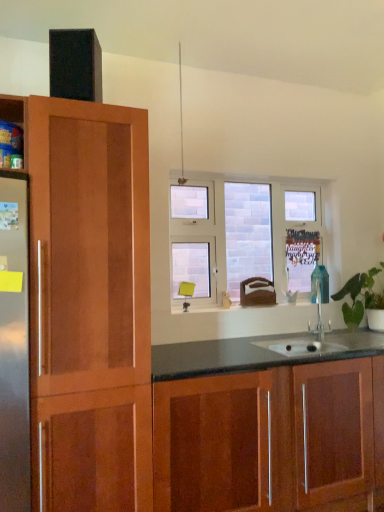
You are a GUI agent. You are given a task and a screenshot of the screen. Output one action in this format:
    pyautogui.click(x=<x>, y=<y>)
    Task: Click on the green leafy plant at right
    This screenshot has height=512, width=384.
    Given the screenshot: What is the action you would take?
    pyautogui.click(x=359, y=294)

Measure the distance between point (347, 322) and camera.

Point (347, 322) and camera are 2.86 meters apart.

Locate an element on the screen. glossy wood cabinets at lower center is located at coordinates (271, 439).

Is the surface of glossy wood cabinets at lower center in direct contact with clear glass window at center?

glossy wood cabinets at lower center and clear glass window at center are clearly separated.

Does point (239, 506) appear closer or farther from the camera than point (221, 182)?

Point (239, 506) appears to be closer to the viewer than point (221, 182).

Does glossy wood cabinets at lower center have a greater width compared to clear glass window at center?

Correct, the width of glossy wood cabinets at lower center exceeds that of clear glass window at center.

Based on the photo, what's the angular difference between glossy wood cabinets at lower center and clear glass window at center's facing directions?

The angle between the facing direction of glossy wood cabinets at lower center and the facing direction of clear glass window at center is 0.284 degrees.

From their relative heights in the image, would you say clear glass window at center is taller or shorter than glossy wood cabinets at lower center?

In the image, clear glass window at center appears to be taller than glossy wood cabinets at lower center.

In the scene shown: Is there a large distance between clear glass window at center and glossy wood cabinets at lower center?

Yes, clear glass window at center is far from glossy wood cabinets at lower center.

Does clear glass window at center have a lesser width compared to glossy wood cabinets at lower center?

Correct, the width of clear glass window at center is less than that of glossy wood cabinets at lower center.

Considering the relative sizes of clear glass window at center and glossy wood cabinets at lower center in the image provided, is clear glass window at center smaller than glossy wood cabinets at lower center?

Yes.

Is glossy wood cabinets at lower center inside the boundaries of green leafy plant at right, or outside?

glossy wood cabinets at lower center exists outside the volume of green leafy plant at right.

Is point (293, 387) farther from viewer compared to point (352, 311)?

No, (293, 387) is in front of (352, 311).

Is glossy wood cabinets at lower center oriented towards green leafy plant at right?

No, glossy wood cabinets at lower center does not turn towards green leafy plant at right.

From the image's perspective, is glossy wood cabinets at lower center on green leafy plant at right?

No, from the image's perspective, glossy wood cabinets at lower center is not over green leafy plant at right.

Measure the distance from green leafy plant at right to clear glass window at center.

A distance of 24.69 inches exists between green leafy plant at right and clear glass window at center.

Is green leafy plant at right not close to clear glass window at center?

They are positioned close to each other.

Would you say green leafy plant at right contains clear glass window at center?

No, clear glass window at center is not surrounded by green leafy plant at right.

Image resolution: width=384 pixels, height=512 pixels. Find the location of `window above the green leafy plant at right (from a real-world perspective)`. window above the green leafy plant at right (from a real-world perspective) is located at coordinates (213, 234).

Where is `houseplant on the right of glossy wood cabinets at lower center`? Image resolution: width=384 pixels, height=512 pixels. houseplant on the right of glossy wood cabinets at lower center is located at coordinates (359, 294).

Looking at their sizes, would you say green leafy plant at right is wider or thinner than glossy wood cabinets at lower center?

Clearly, green leafy plant at right has less width compared to glossy wood cabinets at lower center.

Can we say green leafy plant at right lies outside glossy wood cabinets at lower center?

green leafy plant at right lies outside glossy wood cabinets at lower center's area.

How far apart are green leafy plant at right and glossy wood cabinets at lower center?

green leafy plant at right and glossy wood cabinets at lower center are 94.49 centimeters apart from each other.

Identify the location of window behind the green leafy plant at right. (213, 234).

From a real-world perspective, is clear glass window at center physically above green leafy plant at right?

Yes.

Which is more to the left, clear glass window at center or green leafy plant at right?

From the viewer's perspective, clear glass window at center appears more on the left side.

Is green leafy plant at right completely or partially inside clear glass window at center?

No, green leafy plant at right is not surrounded by clear glass window at center.

Image resolution: width=384 pixels, height=512 pixels. Find the location of `cabinetry located below the clear glass window at center (from the image's perspective)`. cabinetry located below the clear glass window at center (from the image's perspective) is located at coordinates pyautogui.click(x=271, y=439).

Where is `cabinetry in front of the clear glass window at center`? cabinetry in front of the clear glass window at center is located at coordinates (271, 439).

When comparing their distances from clear glass window at center, does green leafy plant at right or glossy wood cabinets at lower center seem closer?

green leafy plant at right is closer to clear glass window at center.

From the picture: When comparing their distances from clear glass window at center, does glossy wood cabinets at lower center or green leafy plant at right seem further?

glossy wood cabinets at lower center.

Which object lies further to the anchor point green leafy plant at right, clear glass window at center or glossy wood cabinets at lower center?

The object further to green leafy plant at right is glossy wood cabinets at lower center.

Based on their spatial positions, is clear glass window at center or green leafy plant at right further from glossy wood cabinets at lower center?

clear glass window at center is positioned further to the anchor glossy wood cabinets at lower center.

Looking at this image, considering their positions, is glossy wood cabinets at lower center positioned further to green leafy plant at right than clear glass window at center?

Among the two, glossy wood cabinets at lower center is located further to green leafy plant at right.

Which object lies further to the anchor point glossy wood cabinets at lower center, green leafy plant at right or clear glass window at center?

clear glass window at center lies further to glossy wood cabinets at lower center than the other object.

What are the coordinates of `houseplant between clear glass window at center and glossy wood cabinets at lower center in the up-down direction` in the screenshot? It's located at (359, 294).